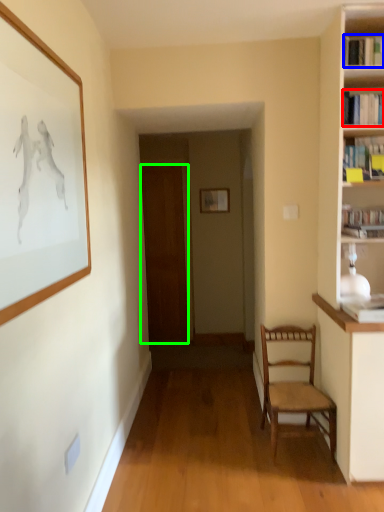
Question: Estimate the real-world distances between objects in this image. Which object is closer to book (highlighted by a red box), book (highlighted by a blue box) or door (highlighted by a green box)?

Choices:
 (A) book
 (B) door

Answer: (A)